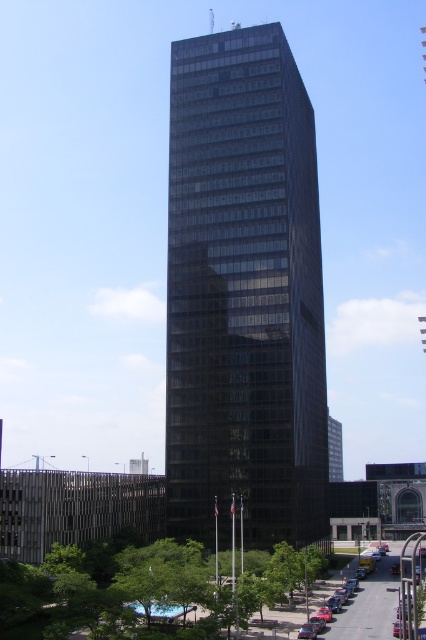
Question: Does dark glass skyscraper at center have a greater width compared to metallic silver sedan at lower right?

Choices:
 (A) yes
 (B) no

Answer: (A)

Question: Is dark glass skyscraper at center in front of metallic silver sedan at lower right?

Choices:
 (A) no
 (B) yes

Answer: (A)

Question: Does dark glass skyscraper at center have a greater width compared to metallic silver sedan at lower right?

Choices:
 (A) yes
 (B) no

Answer: (A)

Question: Which point is farther to the camera?

Choices:
 (A) (230, 154)
 (B) (373, 608)

Answer: (A)